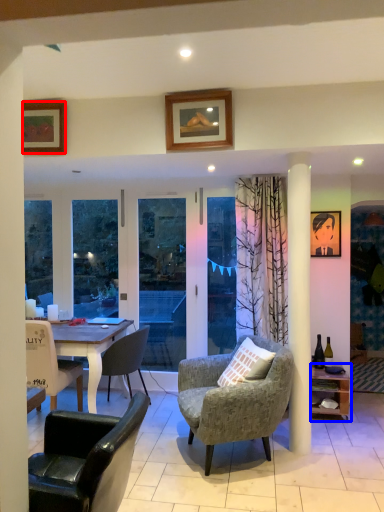
Question: Which point is closer to the camera, picture frame (highlighted by a red box) or shelf (highlighted by a blue box)?

Choices:
 (A) picture frame
 (B) shelf

Answer: (A)